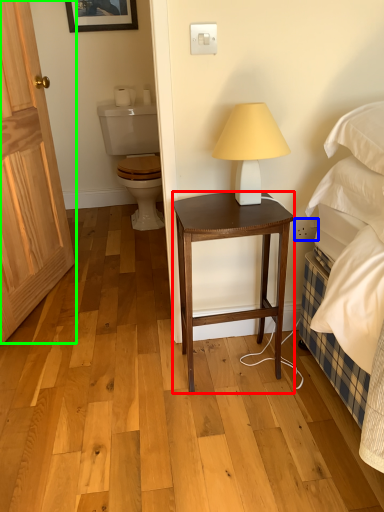
Question: Which is nearer to the stool (highlighted by a red box)? power outlet (highlighted by a blue box) or door (highlighted by a green box).

Choices:
 (A) power outlet
 (B) door

Answer: (A)